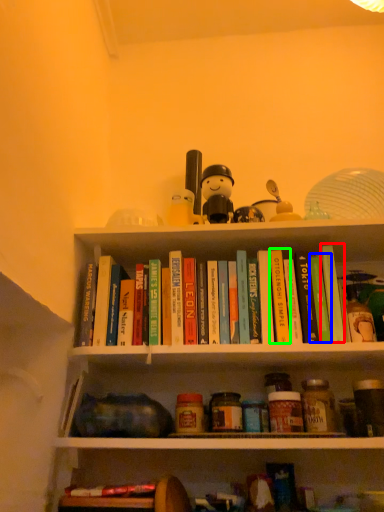
Question: Considering the real-world distances, which object is farthest from paperback book (highlighted by a red box)? paperback book (highlighted by a blue box) or paperback book (highlighted by a green box)?

Choices:
 (A) paperback book
 (B) paperback book

Answer: (B)